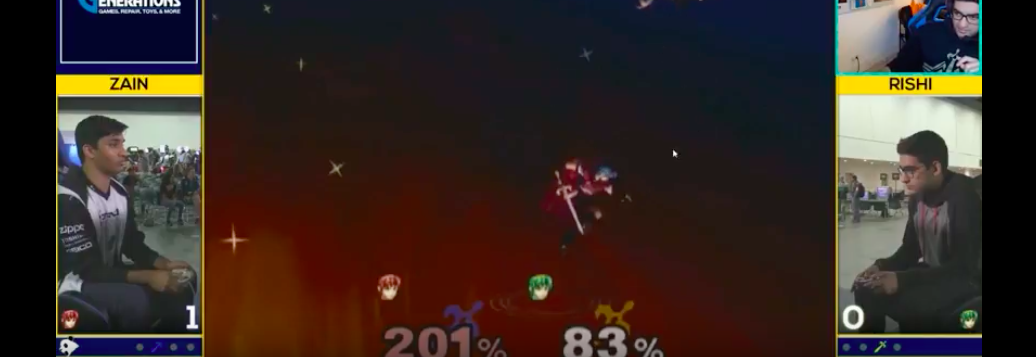
Find the location of `floors`. floors is located at coordinates (171, 245), (880, 234), (886, 72).